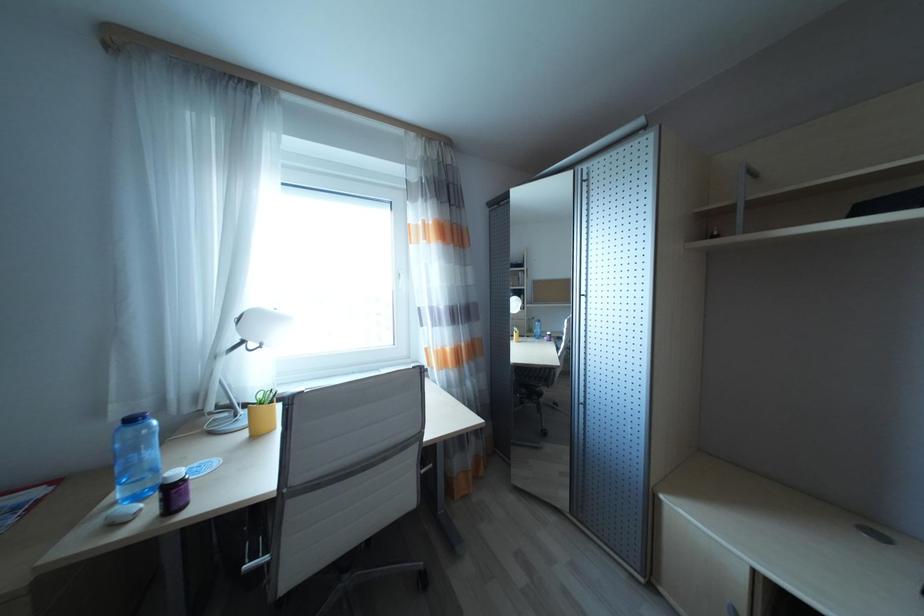
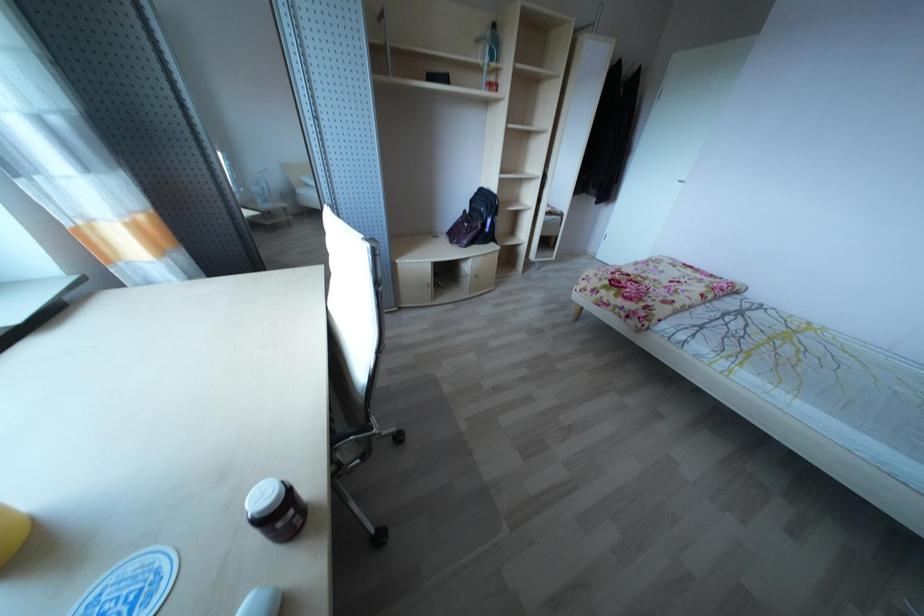
In the scene shown: How did the camera likely rotate?

The camera rotated toward right-down.